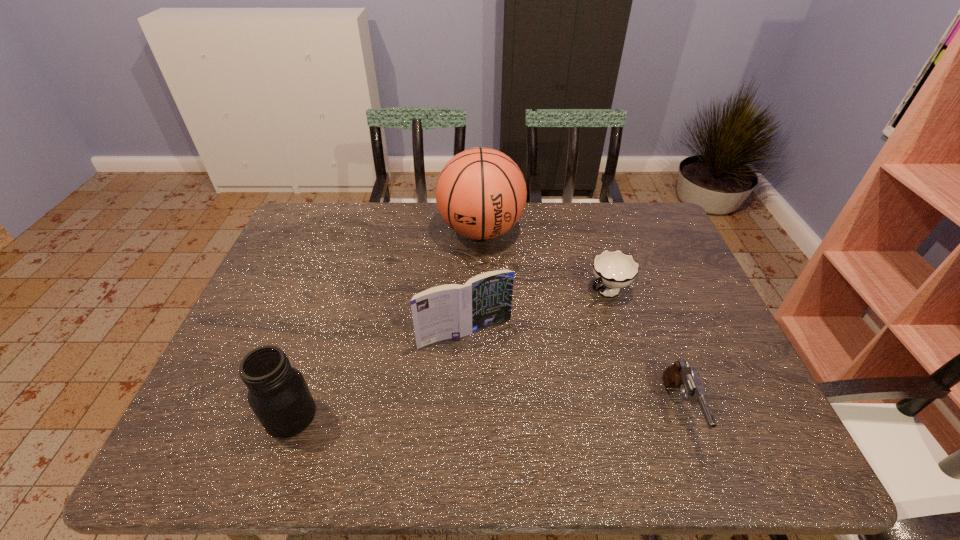
Locate an element on the screen. Image resolution: width=960 pixels, height=540 pixels. vacant area situated on the surface of the basketball near the brand logo is located at coordinates (488, 326).

At what (x,y) coordinates should I click in order to perform the action: click on vacant space located 0.170m on the front cover of the third nearest object. Please return your answer as a coordinate pair (x, y). The height and width of the screenshot is (540, 960). Looking at the image, I should click on (513, 405).

Where is `free space located 0.170m on the front cover of the third nearest object`? free space located 0.170m on the front cover of the third nearest object is located at coordinates (513, 405).

The image size is (960, 540). In order to click on vacant region located 0.160m on the front cover of the third nearest object in this screenshot , I will do `click(511, 402)`.

The width and height of the screenshot is (960, 540). I want to click on blank area located 0.400m on the side of the shortest object with the handle, so click(x=488, y=387).

I want to click on vacant space located 0.160m on the side of the shortest object with the handle, so click(x=556, y=332).

Find the location of a particular element. The image size is (960, 540). free spot located on the side of the shortest object with the handle is located at coordinates (582, 310).

Locate an element on the screen. object present at the far edge is located at coordinates coord(481,193).

Image resolution: width=960 pixels, height=540 pixels. I want to click on jar located in the near edge section of the desktop, so click(278, 394).

You are a GUI agent. You are given a task and a screenshot of the screen. Output one action in this format:
    pyautogui.click(x=<x>, y=<y>)
    Task: Click on the pistol present at the near edge
    The image size is (960, 540).
    Given the screenshot: What is the action you would take?
    coord(679,375)